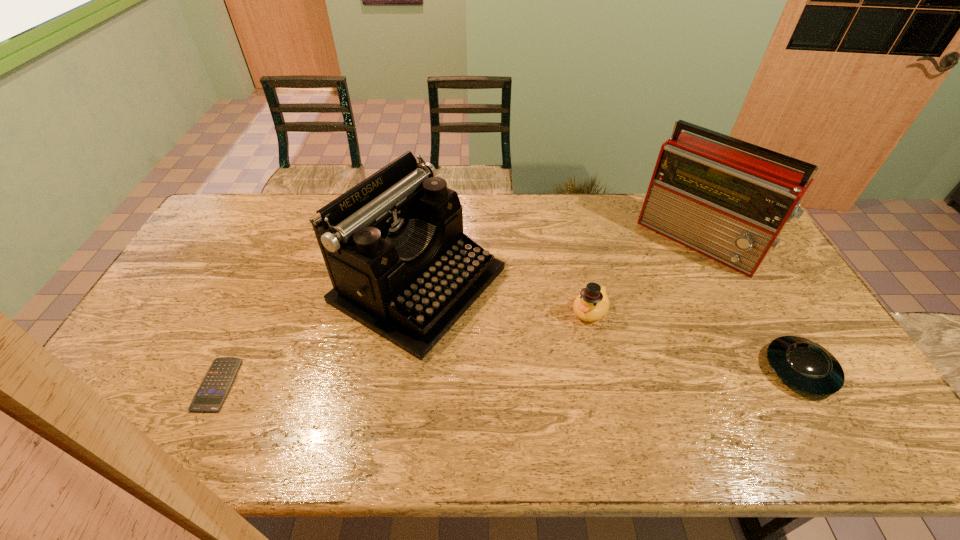
Where is `vacant space that's between the shortest object and the fourth tallest object`? The width and height of the screenshot is (960, 540). vacant space that's between the shortest object and the fourth tallest object is located at coordinates (509, 377).

The width and height of the screenshot is (960, 540). I want to click on free space between the second object from left to right and the calculator, so click(x=318, y=334).

I want to click on free space between the saucer and the radio receiver, so click(x=750, y=305).

Identify the location of unoccupied position between the duck and the typewriter. The width and height of the screenshot is (960, 540). (504, 298).

Where is `free space between the radio receiver and the duck`? This screenshot has width=960, height=540. free space between the radio receiver and the duck is located at coordinates (644, 275).

I want to click on free space that is in between the third shortest object and the saucer, so click(695, 340).

Where is `free space between the fourth object from right to left and the radio receiver`? Image resolution: width=960 pixels, height=540 pixels. free space between the fourth object from right to left and the radio receiver is located at coordinates (559, 262).

The height and width of the screenshot is (540, 960). Find the location of `the third closest object to the typewriter`. the third closest object to the typewriter is located at coordinates (730, 206).

Image resolution: width=960 pixels, height=540 pixels. In order to click on the closest object to the duck in this screenshot , I will do `click(393, 245)`.

Where is `vacant space that satisfies the following two spatial constraints: 1. on the front side of the third object from right to left; 2. on the right side of the typewriter`? This screenshot has width=960, height=540. vacant space that satisfies the following two spatial constraints: 1. on the front side of the third object from right to left; 2. on the right side of the typewriter is located at coordinates (415, 310).